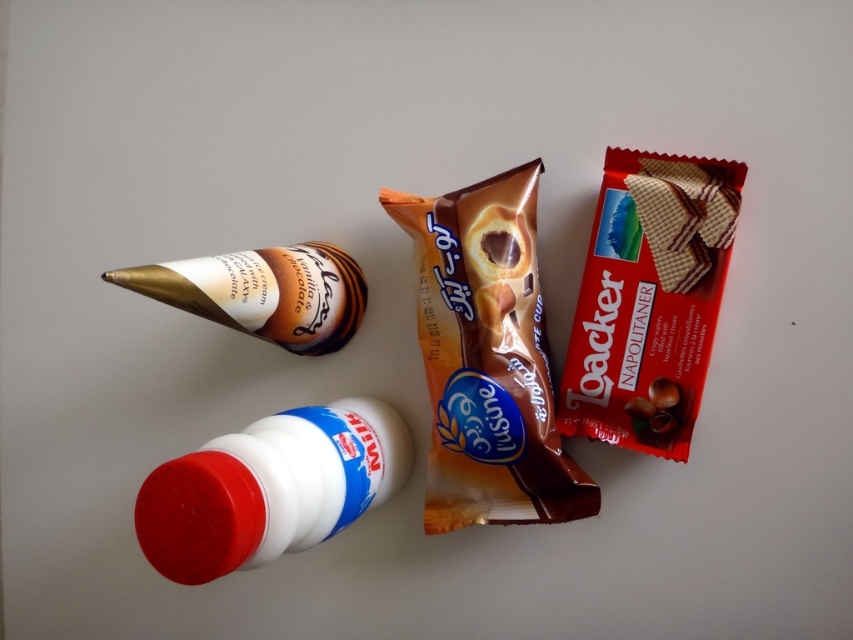
Question: Can you confirm if gold foil cone at left is thinner than matte chocolate wafer at center right?

Choices:
 (A) yes
 (B) no

Answer: (B)

Question: Which point is farther to the camera?

Choices:
 (A) matte brown coffee cup at center
 (B) matte chocolate wafer at center right
 (C) matte red wafer at right

Answer: (A)

Question: Which point is closer to the camera taking this photo?

Choices:
 (A) (660, 211)
 (B) (654, 237)
 (C) (456, 253)
 (D) (244, 291)

Answer: (D)

Question: Can you confirm if matte brown coffee cup at center is thinner than gold foil cone at left?

Choices:
 (A) no
 (B) yes

Answer: (B)

Question: Which point is closer to the camera taking this photo?

Choices:
 (A) (646, 192)
 (B) (496, 460)
 (C) (654, 250)

Answer: (B)

Question: In this image, where is gold foil cone at left located relative to matte chocolate wafer at center right?

Choices:
 (A) above
 (B) below

Answer: (B)